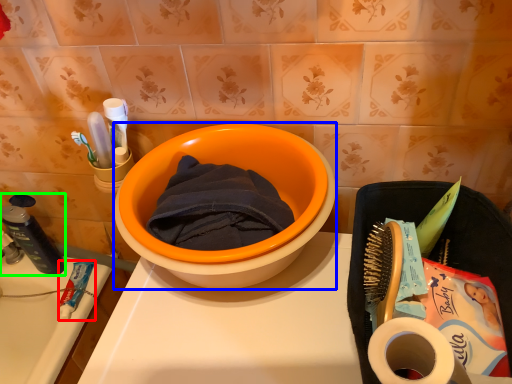
Question: Based on their relative distances, which object is nearer to stationery (highlighted by a red box)? Choose from basin (highlighted by a blue box) and stationery (highlighted by a green box).

Choices:
 (A) basin
 (B) stationery

Answer: (B)